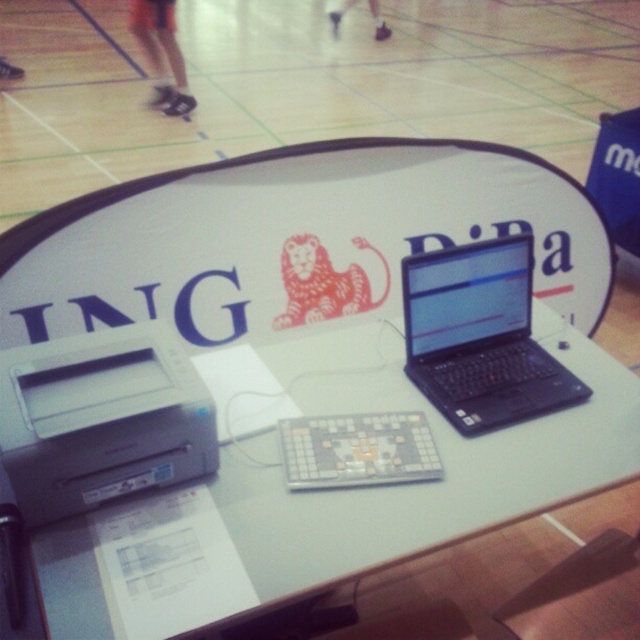
You are setting up for an event and need to place a new item between the gray plastic printer at lower left and the white plastic register at center. Based on their positions, where should you place the new item?

The gray plastic printer at lower left is located above the white plastic register at center, so you should place the new item between them in the space below the gray plastic printer at lower left and above the white plastic register at center.

You are setting up a presentation and need to place a large projector screen on the table. Based on the image, can the white glossy table at center accommodate the black matte laptop at center along with the projector screen?

The white glossy table at center might be wider than black matte laptop at center, so there is a possibility that the table has enough space to accommodate both the laptop and the projector screen. However, the exact dimensions are not provided, so it is uncertain.